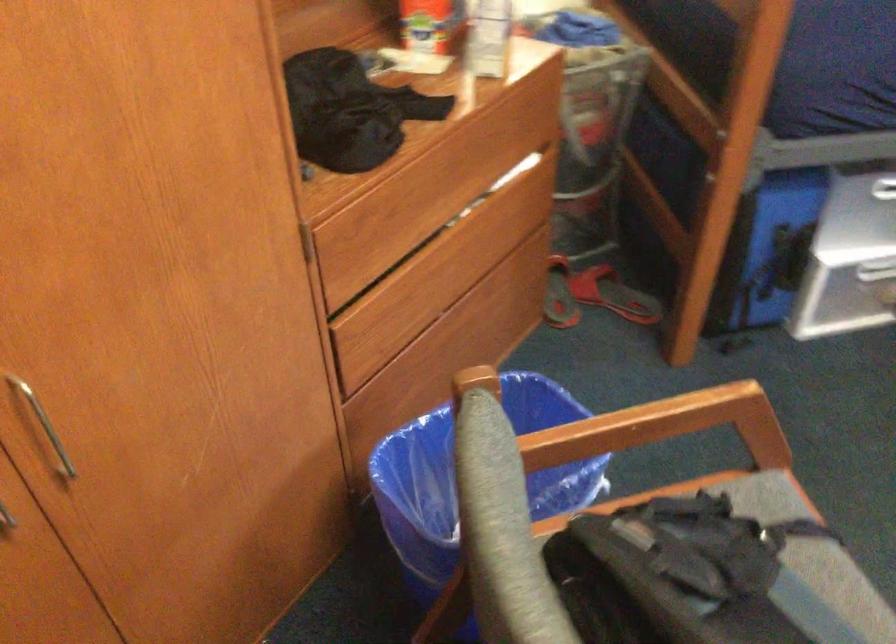
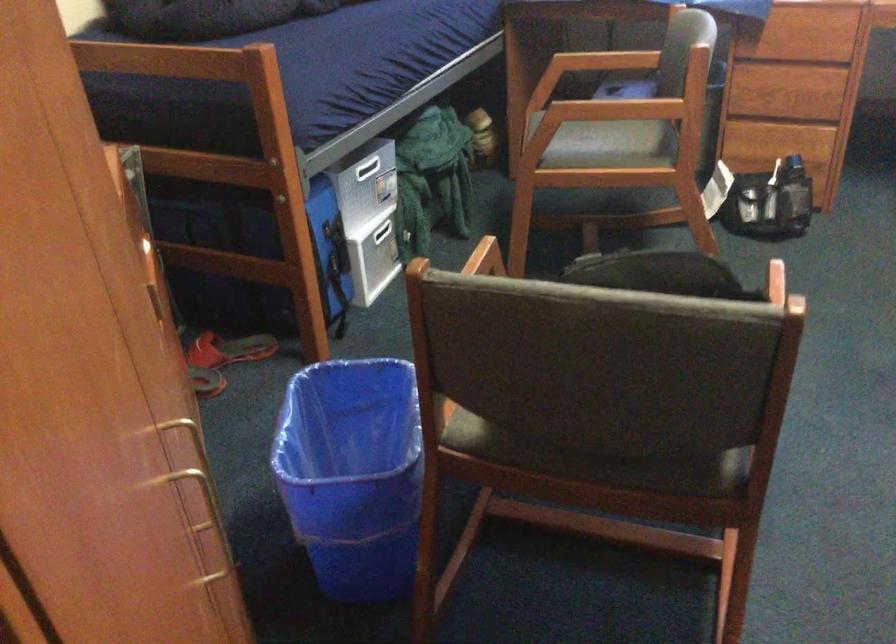
Question: I am providing you with two images of the same scene from different viewpoints. After the viewpoint changes to image2, which objects are now occluded?

Choices:
 (A) blue trash can
 (B) lamp button
 (C) wooden chair armrest
 (D) storage box handle

Answer: (C)